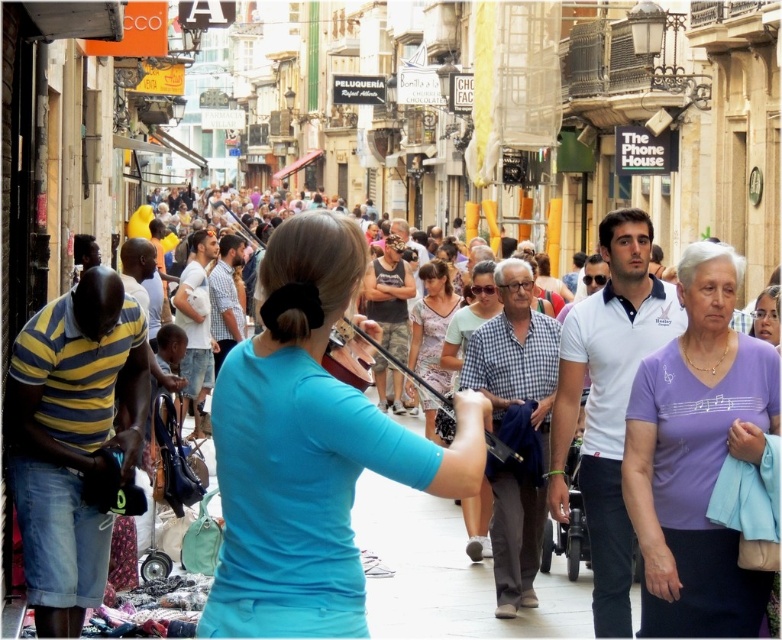
Question: Among these objects, which one is nearest to the camera?

Choices:
 (A) blue matte shirt at center
 (B) purple cotton shirt at center
 (C) printed cotton dress at center

Answer: (A)

Question: In this image, where is blue matte shirt at center located relative to printed cotton dress at center?

Choices:
 (A) left
 (B) right

Answer: (A)

Question: Is blue matte shirt at center to the left of purple cotton shirt at center from the viewer's perspective?

Choices:
 (A) yes
 (B) no

Answer: (A)

Question: Which is nearer to the purple cotton shirt at center?

Choices:
 (A) printed cotton dress at center
 (B) blue matte shirt at center

Answer: (B)

Question: Does purple cotton shirt at center have a lesser width compared to printed cotton dress at center?

Choices:
 (A) yes
 (B) no

Answer: (B)

Question: Which object is the farthest from the purple cotton shirt at center?

Choices:
 (A) printed cotton dress at center
 (B) blue matte shirt at center

Answer: (A)